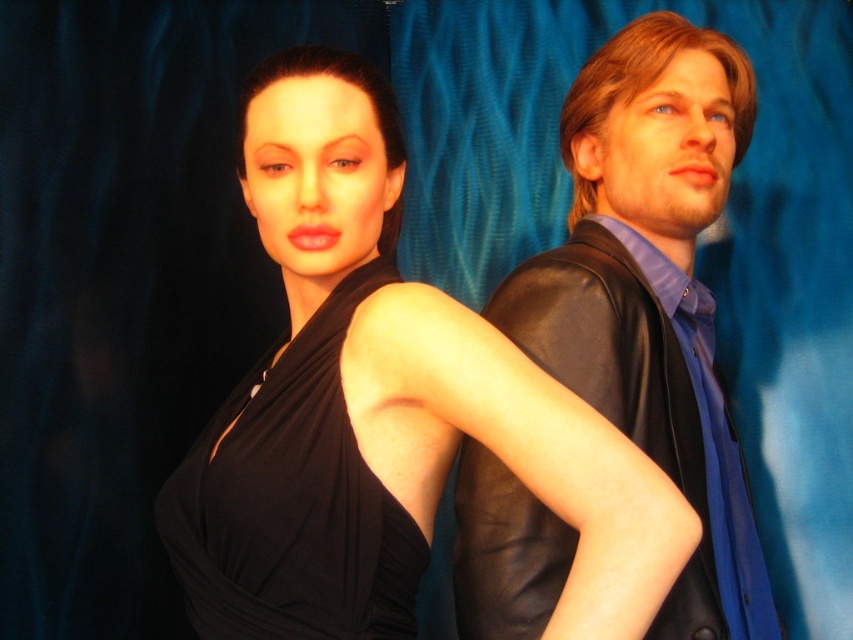
Is black matte dress at center positioned at the back of black satin dress at upper left?

No, black matte dress at center is closer to the viewer.

Who is more forward, (194, 573) or (376, 480)?

Point (376, 480)

Where is `black matte dress at center`? The image size is (853, 640). black matte dress at center is located at coordinates (384, 408).

Who is taller, leather jacket at right or black satin dress at upper left?

Standing taller between the two is leather jacket at right.

Which is in front, point (654, 138) or point (225, 524)?

Point (225, 524) is more forward.

The width and height of the screenshot is (853, 640). Find the location of `leather jacket at right`. leather jacket at right is located at coordinates (653, 292).

Based on the photo, can you confirm if black matte dress at center is taller than leather jacket at right?

Incorrect, black matte dress at center's height is not larger of leather jacket at right's.

Is black matte dress at center positioned at the back of leather jacket at right?

No, it is in front of leather jacket at right.

This screenshot has height=640, width=853. I want to click on black matte dress at center, so click(x=384, y=408).

This screenshot has width=853, height=640. I want to click on black matte dress at center, so click(x=384, y=408).